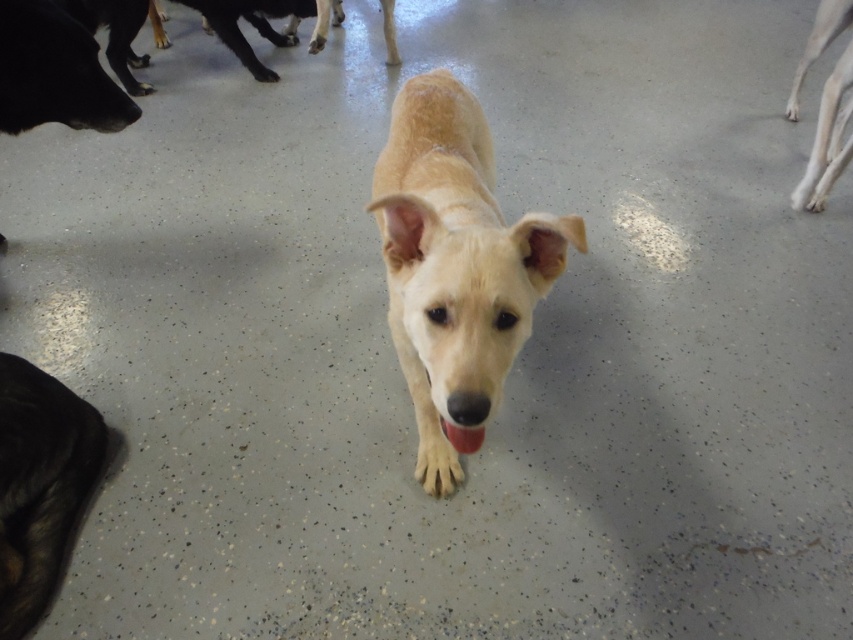
Based on the scene description, where is the light brown fur at center in relation to the light brown fur at right?

The light brown fur at center is to the left of the light brown fur at right.

You are a dog owner trying to identify which of your dogs is in the foreground. You see the shiny black fur at lower left and the light brown fur at right. Which dog is closer to you?

The shiny black fur at lower left is smaller than light brown fur at right, so the shiny black fur at lower left is closer to you.